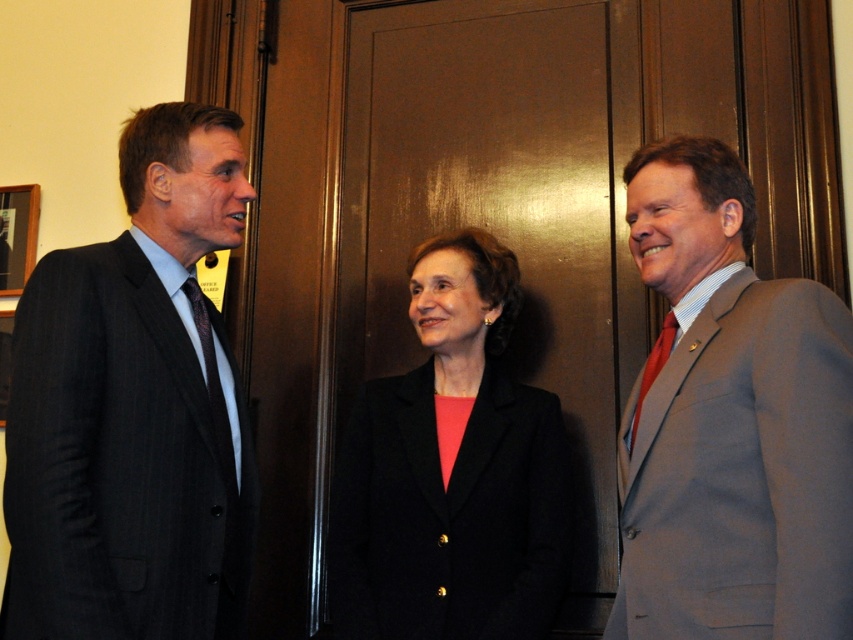
Question: Estimate the real-world distances between objects in this image. Which object is farther from the dark gray suit at left?

Choices:
 (A) gray wool suit at right
 (B) dark blue textured tie at left
 (C) red silk tie at right
 (D) black matte blazer at center

Answer: (C)

Question: Does dark blue textured tie at left lie in front of red silk tie at right?

Choices:
 (A) yes
 (B) no

Answer: (A)

Question: Does gray wool suit at right lie in front of red silk tie at right?

Choices:
 (A) yes
 (B) no

Answer: (A)

Question: Which of the following is the closest to the observer?

Choices:
 (A) (404, 436)
 (B) (659, 360)

Answer: (B)

Question: Can you confirm if dark gray suit at left is smaller than red silk tie at right?

Choices:
 (A) no
 (B) yes

Answer: (A)

Question: Among these points, which one is farthest from the camera?

Choices:
 (A) (212, 372)
 (B) (717, 605)

Answer: (A)